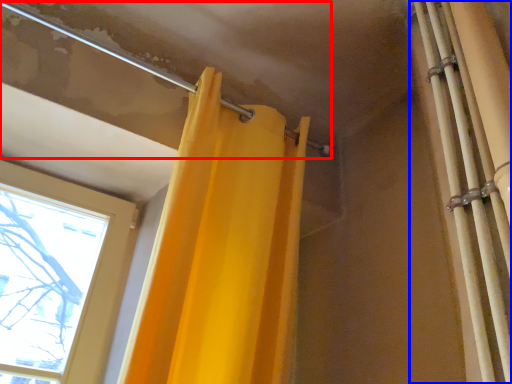
Question: Which point is closer to the camera, pipe (highlighted by a red box) or shower curtain (highlighted by a blue box)?

Choices:
 (A) pipe
 (B) shower curtain

Answer: (B)